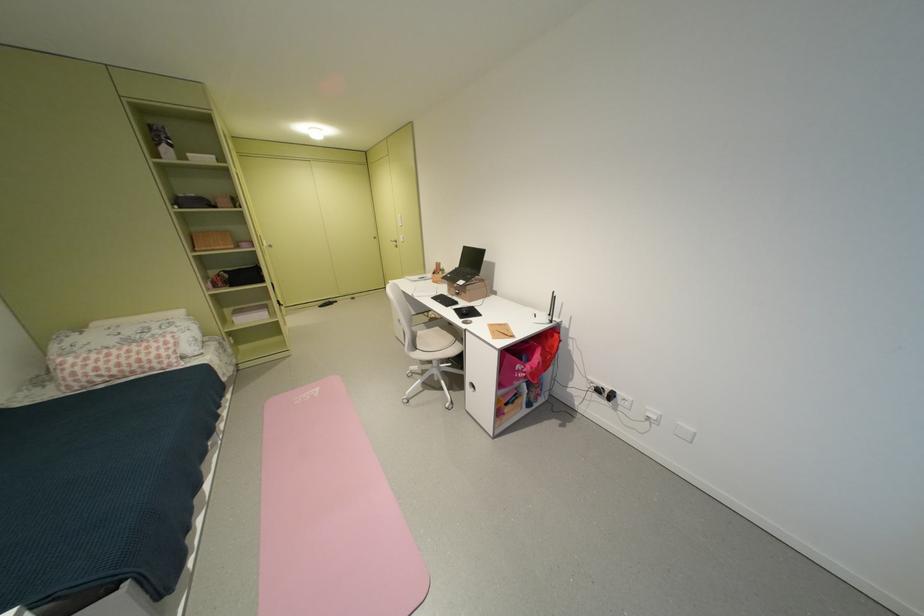
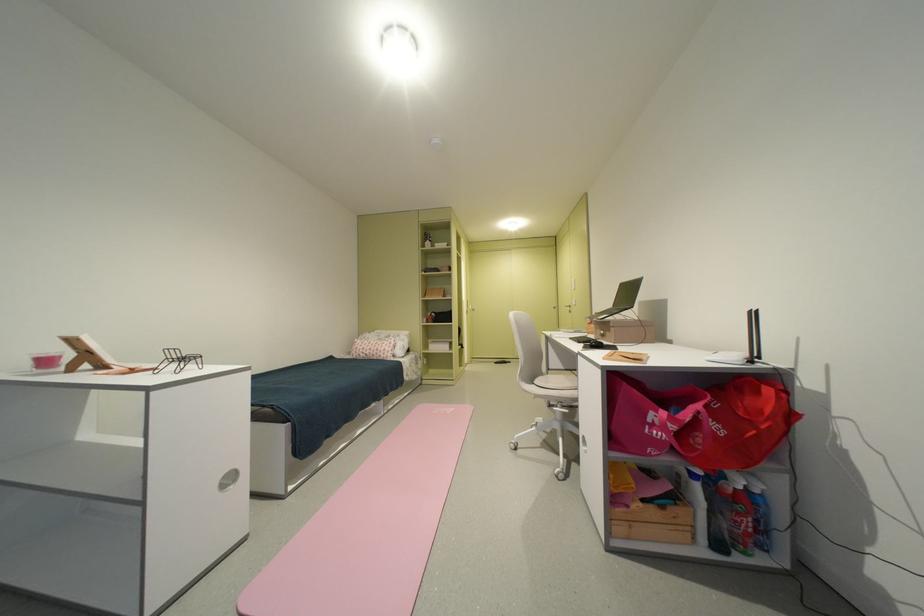
The point at [473,312] is marked in the first image. Where is the corresponding point in the second image?

(602, 342)